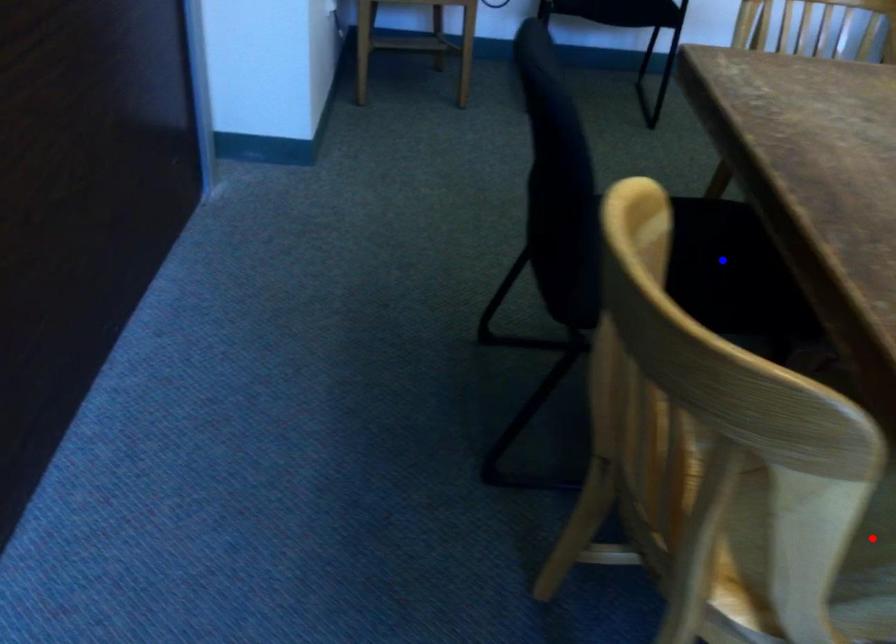
Question: Two points are marked on the image. Which point is closer to the camera?

Choices:
 (A) Blue point is closer.
 (B) Red point is closer.

Answer: (B)